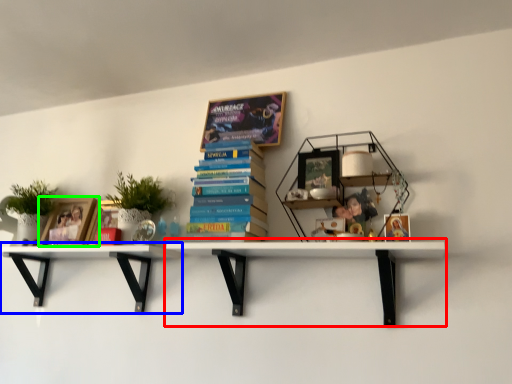
Question: Estimate the real-world distances between objects in this image. Which object is farther from shelf (highlighted by a red box), shelf (highlighted by a blue box) or book cover (highlighted by a green box)?

Choices:
 (A) shelf
 (B) book cover

Answer: (B)